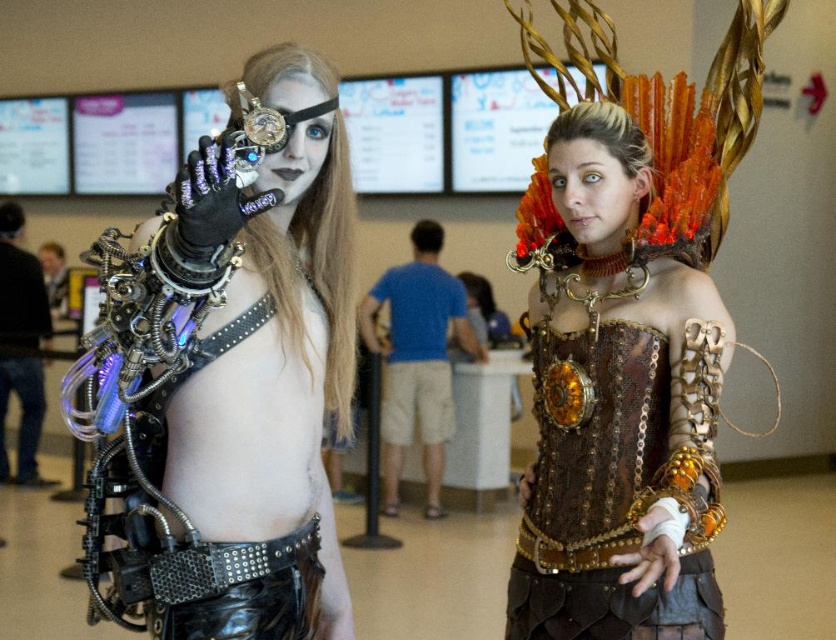
You are a costume designer trying to decide whether to place a new accessory between the brown leather corset at center and the matte black eye at center. Based on their widths, which object should you place the accessory closer to to ensure it fits properly?

The brown leather corset at center might be wider than matte black eye at center, so placing the accessory closer to the brown leather corset at center would ensure it fits properly due to its wider width.

You are a photographer at the convention center and need to capture both the steampunk armor at center and the blue fabric shirt at center in a single shot. Which object should you focus on first to ensure both are in frame?

The steampunk armor at center is shorter than the blue fabric shirt at center, so focus on the blue fabric shirt at center first to ensure both are in frame.

Based on the photo, you are at a costume party and see two people wearing steampunk costumes. One has a matte gold face at center and the other has a matte black eye at center. Which of these two features is positioned lower on their respective faces?

The matte gold face at center is located below the matte black eye at center, so the matte gold face at center is positioned lower on their respective faces.